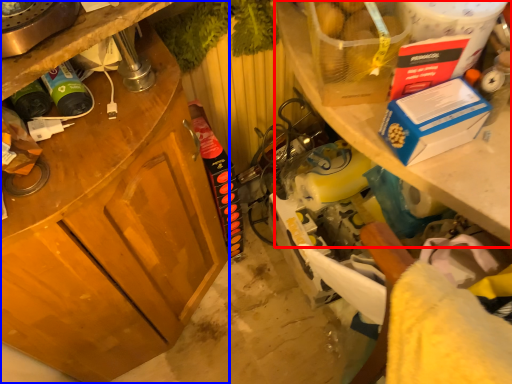
Question: Among these objects, which one is nearest to the camera, shelf (highlighted by a red box) or cabinetry (highlighted by a blue box)?

Choices:
 (A) shelf
 (B) cabinetry

Answer: (B)